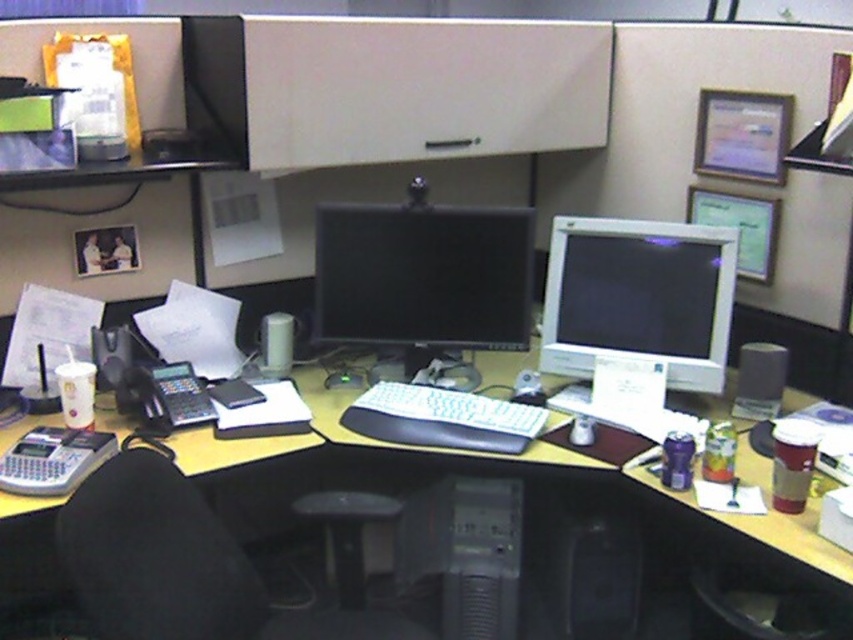
Describe the element at coordinates (482, 468) in the screenshot. The height and width of the screenshot is (640, 853). I see `white plastic computer desk at center` at that location.

Which is in front, point (187, 472) or point (566, 269)?

Point (187, 472)

Is point (741, 452) positioned before point (577, 225)?

Yes.

Where is `white plastic computer desk at center`? The height and width of the screenshot is (640, 853). white plastic computer desk at center is located at coordinates (482, 468).

Which of these two, black glossy monitor at center or black plastic mouse at center, stands shorter?

Standing shorter between the two is black plastic mouse at center.

Who is higher up, black glossy monitor at center or black plastic mouse at center?

black glossy monitor at center is above.

You are a GUI agent. You are given a task and a screenshot of the screen. Output one action in this format:
    pyautogui.click(x=<x>, y=<y>)
    Task: Click on the black glossy monitor at center
    The image size is (853, 640).
    Given the screenshot: What is the action you would take?
    tap(422, 275)

Is white glossy monitor at center in front of black plastic mouse at center?

No, it is not.

Between white glossy monitor at center and black plastic mouse at center, which one is positioned lower?

black plastic mouse at center

What do you see at coordinates (639, 298) in the screenshot? The width and height of the screenshot is (853, 640). I see `white glossy monitor at center` at bounding box center [639, 298].

Locate an element on the screen. white glossy monitor at center is located at coordinates (639, 298).